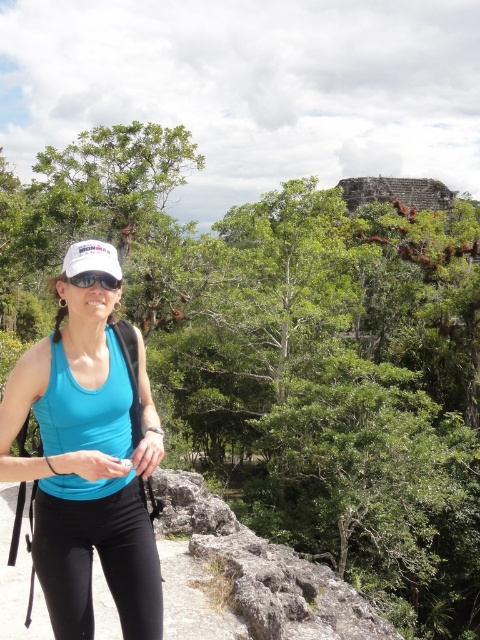
You are a photographer trying to capture the person in the image. The person is standing at point (88, 454). You want to position yourself so that the person is centered in your frame. Which direction should you move relative to the current camera position?

The person is already centered at point (88, 454), so you don not need to move. Keep the camera positioned to have the person centered.

You are a hiker who needs to adjust your gear. You have a matte blue tank top at center and matte black goggles at center. Which item should you adjust first if you want to reach the one that is higher up?

The matte black goggles at center are higher up than the matte blue tank top at center, so you should adjust the matte black goggles at center first.